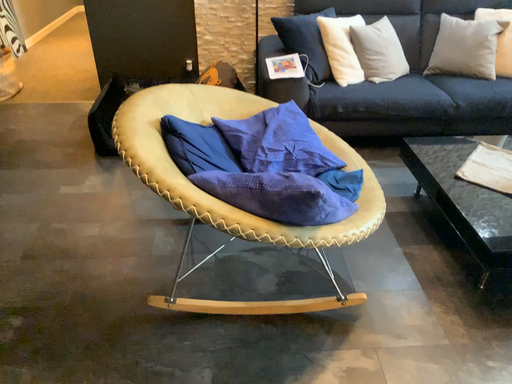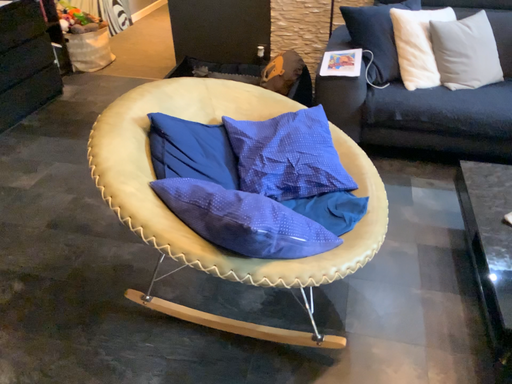
Question: Which way did the camera rotate in the video?

Choices:
 (A) rotated right
 (B) rotated left

Answer: (B)